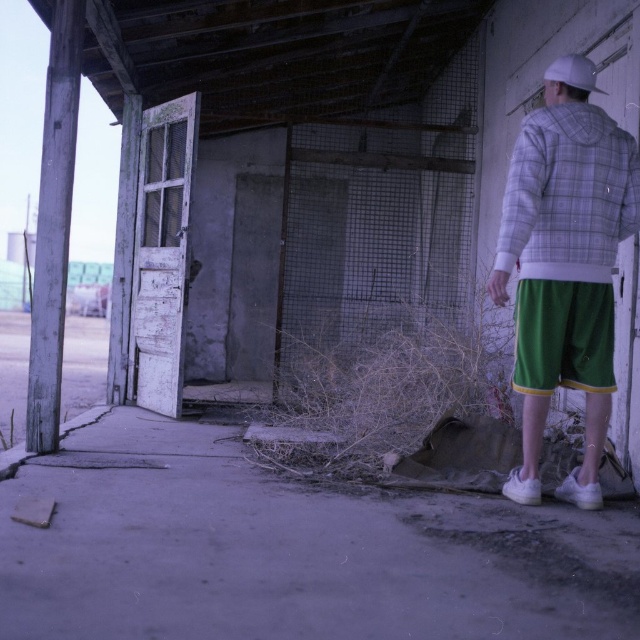
Can you confirm if green cotton shorts at right is wider than white matte baseball hat at upper right?

Indeed, green cotton shorts at right has a greater width compared to white matte baseball hat at upper right.

Which is in front, point (531, 384) or point (563, 76)?

Point (531, 384) is in front.

What are the coordinates of `green cotton shorts at right` in the screenshot? It's located at (563, 337).

Between white plaid hoodie at right and white matte baseball hat at upper right, which one is positioned higher?

Positioned higher is white matte baseball hat at upper right.

Is white plaid hoodie at right thinner than white matte baseball hat at upper right?

No.

Does point (582, 483) lie behind point (566, 60)?

Yes.

You are a GUI agent. You are given a task and a screenshot of the screen. Output one action in this format:
    pyautogui.click(x=<x>, y=<y>)
    Task: Click on the white plaid hoodie at right
    Image resolution: width=640 pixels, height=640 pixels.
    Given the screenshot: What is the action you would take?
    pyautogui.click(x=564, y=273)

Who is shorter, white plaid hoodie at right or green cotton shorts at right?

Standing shorter between the two is green cotton shorts at right.

Can you confirm if white plaid hoodie at right is thinner than green cotton shorts at right?

In fact, white plaid hoodie at right might be wider than green cotton shorts at right.

Where is `white plaid hoodie at right`? The image size is (640, 640). white plaid hoodie at right is located at coordinates (564, 273).